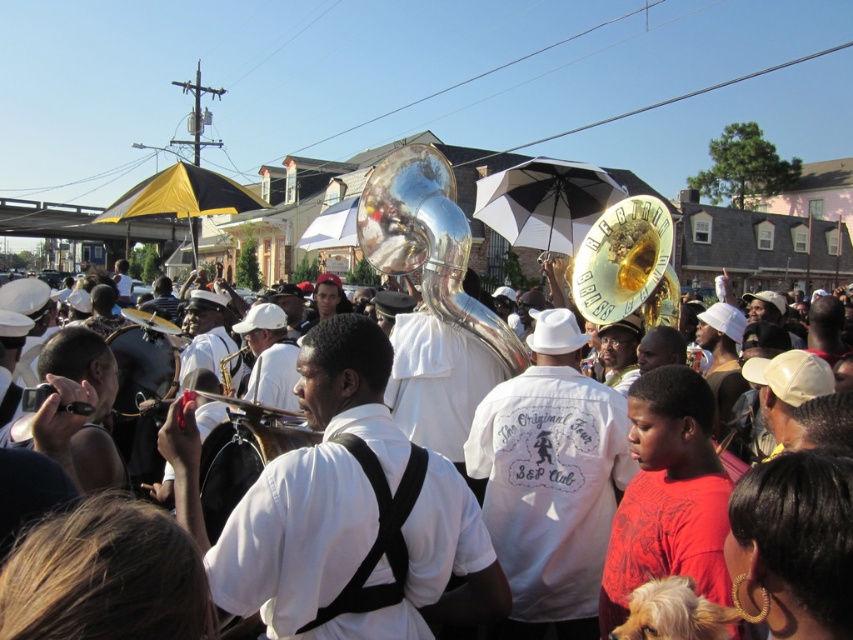
You are a photographer trying to capture a clear shot of the gold shiny tuba at center and the white matte uniform at center. Which object should you focus on first if you want to ensure both are in focus without adjusting your camera settings?

The white matte uniform at center is larger in size than the gold shiny tuba at center, so focusing on the larger object first would help ensure both are in focus.

You are a photographer holding the black matte camera at center. You want to take a photo of the silver metallic tuba at center. Can you fit the entire tuba into your camera frame without moving your position? Explain why or why not based on their sizes.

The silver metallic tuba at center is wider than the black matte camera at center. Since the tuba is wider, it might not fit entirely within the camera frame unless the camera has a wide enough lens to accommodate its width.

From the picture: You are a photographer standing at the center of the scene. You want to take a photo that includes both point (405, 589) and point (665, 212). Which point should you focus on to ensure both are in sharp focus?

You should focus on point (665, 212) because it is farther from the camera than point (405, 589). By focusing on the farther point, the depth of field will include the closer point as well.